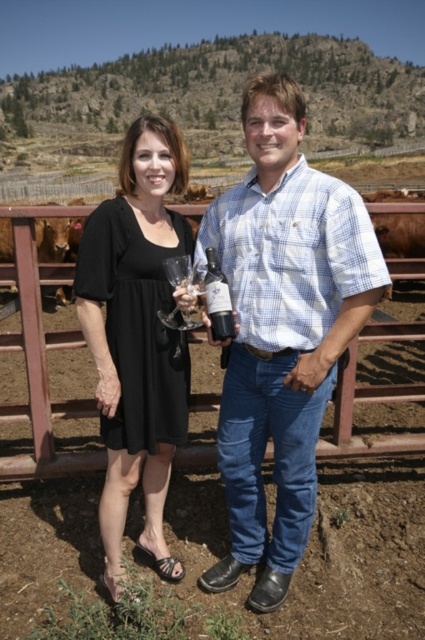
Question: Among these objects, which one is farthest from the camera?

Choices:
 (A) clear glass wine glass at center
 (B) blue checkered shirt at center
 (C) black matte dress at center
 (D) dark red glass bottle at center

Answer: (D)

Question: In this image, where is blue checkered shirt at center located relative to black matte dress at center?

Choices:
 (A) left
 (B) right

Answer: (B)

Question: Which is nearer to the dark red glass bottle at center?

Choices:
 (A) black matte dress at center
 (B) clear glass wine glass at center
 (C) blue checkered shirt at center

Answer: (B)

Question: Does blue checkered shirt at center have a greater width compared to dark red glass bottle at center?

Choices:
 (A) yes
 (B) no

Answer: (A)

Question: Which point is closer to the camera?

Choices:
 (A) dark red glass bottle at center
 (B) black matte dress at center
 (C) clear glass wine glass at center
 (D) blue checkered shirt at center

Answer: (B)

Question: Can you confirm if black matte dress at center is positioned to the right of dark red glass bottle at center?

Choices:
 (A) no
 (B) yes

Answer: (A)